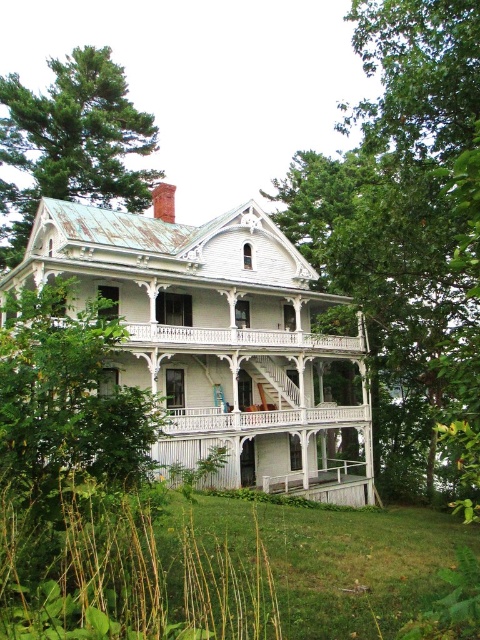
Question: Which object appears farthest from the camera in this image?

Choices:
 (A) green leafy tree at upper left
 (B) green leafy tree at center

Answer: (A)

Question: Which point is closer to the camera taking this photo?

Choices:
 (A) pyautogui.click(x=386, y=20)
 (B) pyautogui.click(x=92, y=100)

Answer: (A)

Question: Does green leafy tree at center appear over green leafy tree at upper left?

Choices:
 (A) yes
 (B) no

Answer: (B)

Question: Can you confirm if green leafy tree at center is wider than green leafy tree at upper left?

Choices:
 (A) yes
 (B) no

Answer: (B)

Question: Is green leafy tree at center to the left of green leafy tree at upper left from the viewer's perspective?

Choices:
 (A) yes
 (B) no

Answer: (B)